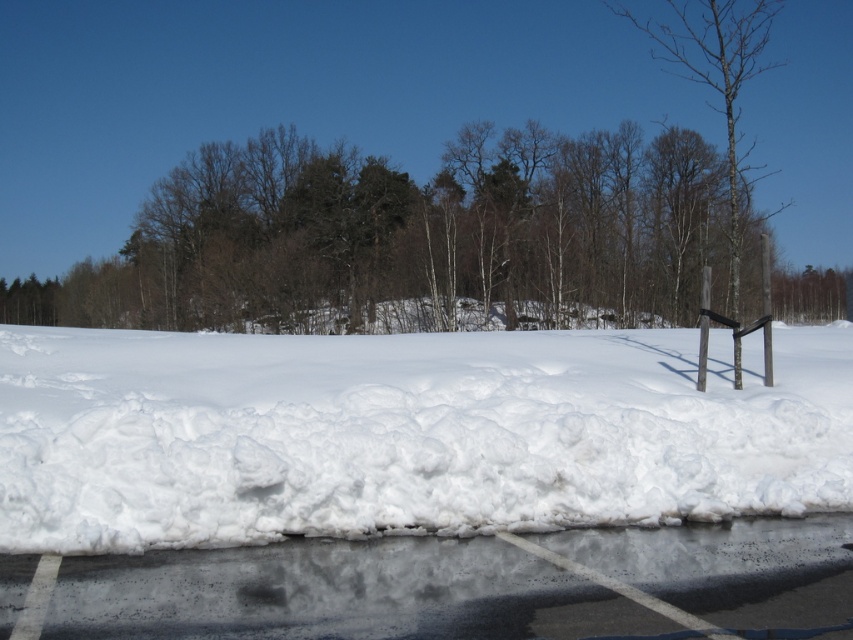
Between white fluffy snow at center and black asphalt at lower center, which one appears on the right side from the viewer's perspective?

Positioned to the right is white fluffy snow at center.

Does point (300, 518) come farther from viewer compared to point (503, 556)?

Yes, point (300, 518) is farther from viewer.

The width and height of the screenshot is (853, 640). Find the location of `white fluffy snow at center`. white fluffy snow at center is located at coordinates (405, 433).